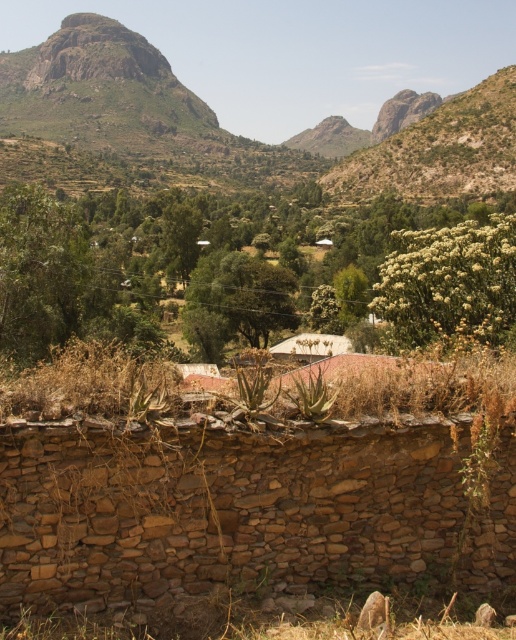
You are standing at the point marked by the coordinates (192, 262) in the image. What object is exactly at your current location?

The green leafy bush at center is located at point (192, 262), so the object exactly at your current location is the green leafy bush at center.

You are standing in the rural landscape and want to place a small flag at each of the two points marked as point (261, 298) and point (319, 339). Which point is closer to you when you are facing the scene?

Point (261, 298) is closer to you than point (319, 339) because it is further to the viewer according to the description.

You are standing at the origin point in this rural landscape. Where is the green leafy bush at center located in terms of coordinates?

The green leafy bush at center is located at coordinates 0.412 in the x direction and 0.374 in the y direction.